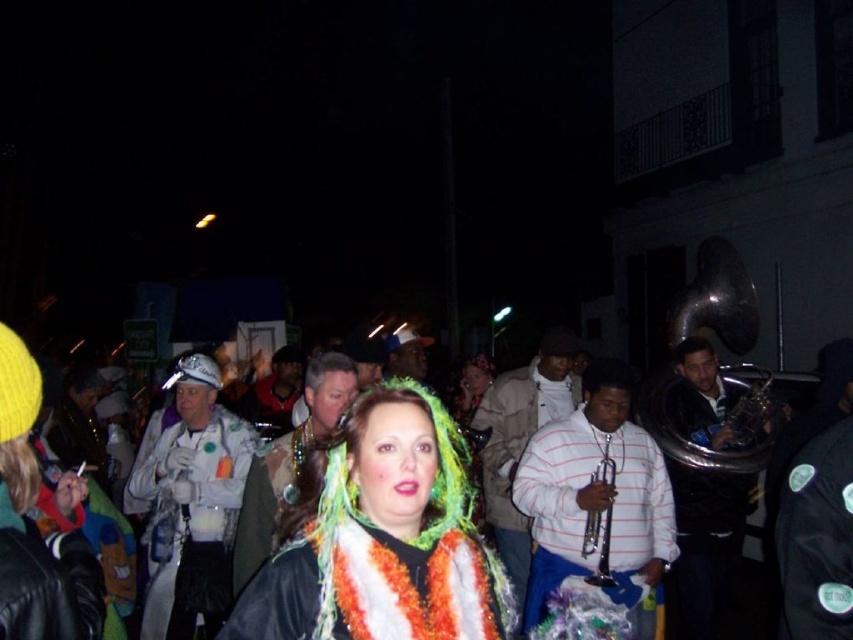
Between fluffy multicolored scarf at center and white striped shirt at center, which one is positioned higher?

fluffy multicolored scarf at center is above.

Image resolution: width=853 pixels, height=640 pixels. What do you see at coordinates (378, 548) in the screenshot?
I see `fluffy multicolored scarf at center` at bounding box center [378, 548].

Locate an element on the screen. The width and height of the screenshot is (853, 640). fluffy multicolored scarf at center is located at coordinates (378, 548).

Where is `fluffy multicolored scarf at center`? This screenshot has height=640, width=853. fluffy multicolored scarf at center is located at coordinates pyautogui.click(x=378, y=548).

Who is positioned more to the left, fluffy multicolored scarf at center or knitted wool scarf at center?

Positioned to the left is fluffy multicolored scarf at center.

Is fluffy multicolored scarf at center smaller than knitted wool scarf at center?

Incorrect, fluffy multicolored scarf at center is not smaller in size than knitted wool scarf at center.

What do you see at coordinates (378, 548) in the screenshot? The width and height of the screenshot is (853, 640). I see `fluffy multicolored scarf at center` at bounding box center [378, 548].

This screenshot has height=640, width=853. Identify the location of fluffy multicolored scarf at center. (378, 548).

From the picture: Measure the distance between knitted wool scarf at center and white striped shirt at center.

2.61 meters

Can you confirm if knitted wool scarf at center is thinner than white striped shirt at center?

Yes, knitted wool scarf at center is thinner than white striped shirt at center.

Who is more distant from viewer, [390,589] or [662,541]?

Point [662,541]

Locate an element on the screen. The width and height of the screenshot is (853, 640). knitted wool scarf at center is located at coordinates (410, 588).